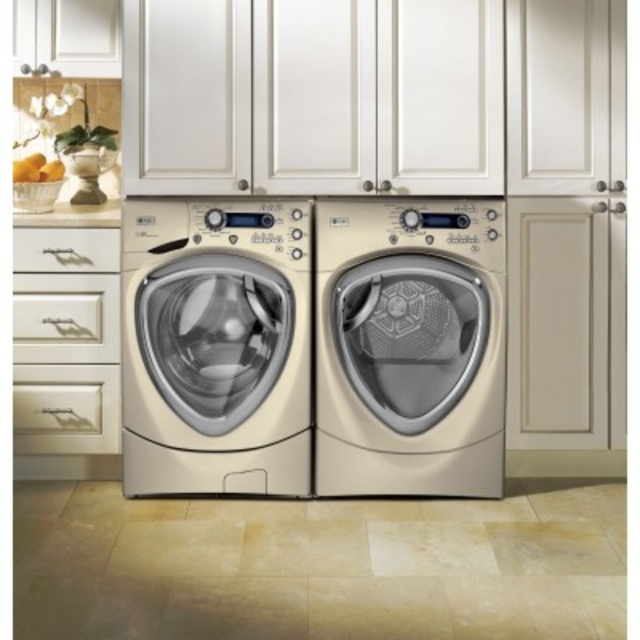
In the scene shown: Can you confirm if matte beige washing machine at center is shorter than cream matte washing machine at center?

Yes.

Describe the element at coordinates (410, 346) in the screenshot. I see `matte beige washing machine at center` at that location.

Locate an element on the screen. matte beige washing machine at center is located at coordinates (410, 346).